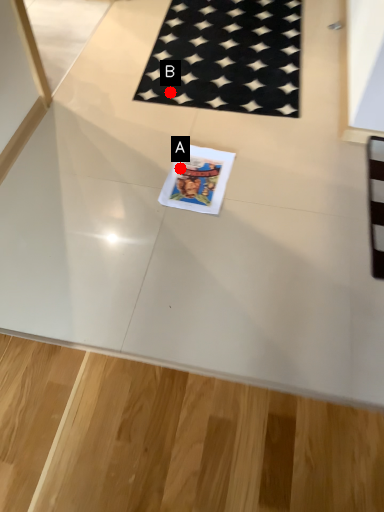
Question: Two points are circled on the image, labeled by A and B beside each circle. Among these points, which one is nearest to the camera?

Choices:
 (A) A is closer
 (B) B is closer

Answer: (A)